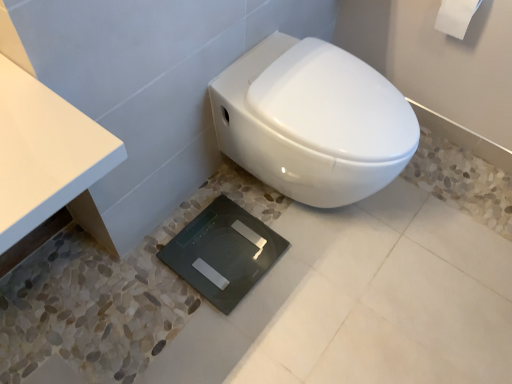
Locate an element on the screen. free space between white glossy toilet at center and black glass scale at center is located at coordinates (262, 256).